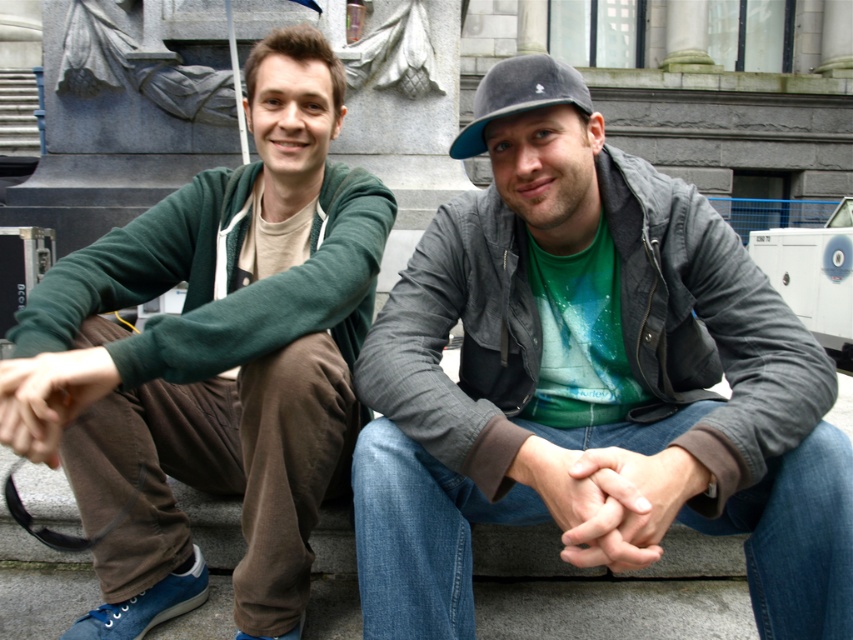
You are standing at the origin point of the image. Which of the two points, point (195, 211) or point (607, 538), is located behind the other?

Point (195, 211) is behind point (607, 538).

You are an AI analyzing the spatial coordinates of objects in an image. The scene shows two people sitting on stone steps. You need to determine the exact 2D coordinates of the matte gray jacket at center. What are its coordinates?

The matte gray jacket at center is located at the 2D coordinates of point (590,381).